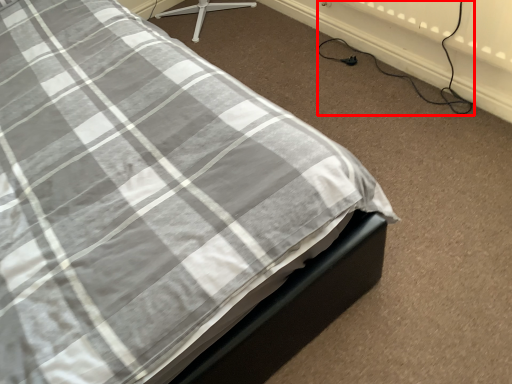
Question: In this image, where is cable (annotated by the red box) located relative to plug?

Choices:
 (A) right
 (B) left

Answer: (A)